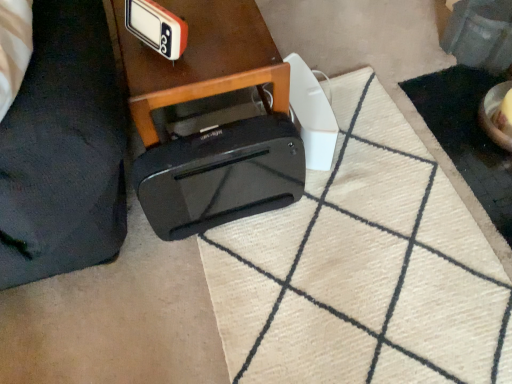
What is the approximate width of black plastic bag at lower left?

black plastic bag at lower left is 17.60 inches in width.

Describe the element at coordinates (220, 175) in the screenshot. I see `black plastic toaster at lower center` at that location.

Describe the element at coordinates (311, 115) in the screenshot. I see `white plastic speaker at center` at that location.

Where is `white textured doormat at lower center`? This screenshot has width=512, height=384. white textured doormat at lower center is located at coordinates (362, 268).

Which of these two, black plastic bag at lower left or white plastic speaker at center, stands taller?

black plastic bag at lower left is taller.

In terms of width, does black plastic bag at lower left look wider or thinner when compared to white plastic speaker at center?

Clearly, black plastic bag at lower left has more width compared to white plastic speaker at center.

Is there a large distance between black plastic bag at lower left and white plastic speaker at center?

No, black plastic bag at lower left is not far from white plastic speaker at center.

Which of these two, black glossy printer at center or white plastic speaker at center, stands taller?

black glossy printer at center is taller.

Considering the relative sizes of black glossy printer at center and white plastic speaker at center in the image provided, is black glossy printer at center bigger than white plastic speaker at center?

Indeed, black glossy printer at center has a larger size compared to white plastic speaker at center.

Based on the photo, would you say black plastic bag at lower left is outside white textured doormat at lower center?

Yes, black plastic bag at lower left is not within white textured doormat at lower center.

From the image's perspective, does black plastic bag at lower left appear higher than white textured doormat at lower center?

Yes, from the image's perspective, black plastic bag at lower left is on top of white textured doormat at lower center.

Is black plastic bag at lower left wider than white textured doormat at lower center?

Incorrect, the width of black plastic bag at lower left does not surpass that of white textured doormat at lower center.

Is black plastic bag at lower left positioned behind black plastic toaster at lower center?

No, black plastic bag at lower left is closer to the camera.

Based on their sizes in the image, would you say black plastic bag at lower left is bigger or smaller than black plastic toaster at lower center?

black plastic bag at lower left is bigger than black plastic toaster at lower center.

Is black plastic bag at lower left not within black plastic toaster at lower center?

black plastic bag at lower left is positioned outside black plastic toaster at lower center.

Is black plastic bag at lower left far away from black plastic toaster at lower center?

That's not correct — black plastic bag at lower left is a little close to black plastic toaster at lower center.

Between white textured doormat at lower center and orange plastic clock at upper center, which one has larger size?

Bigger between the two is white textured doormat at lower center.

Which is more to the right, white textured doormat at lower center or orange plastic clock at upper center?

Positioned to the right is white textured doormat at lower center.

From the image's perspective, which one is positioned higher, white textured doormat at lower center or orange plastic clock at upper center?

orange plastic clock at upper center, from the image's perspective.

In the scene shown: Which object is closer to the camera, white textured doormat at lower center or orange plastic clock at upper center?

orange plastic clock at upper center is closer to the camera.

Is orange plastic clock at upper center positioned before black glossy printer at center?

Yes, orange plastic clock at upper center is in front of black glossy printer at center.

In the scene shown: Is orange plastic clock at upper center bigger or smaller than black glossy printer at center?

orange plastic clock at upper center is smaller than black glossy printer at center.

How many degrees apart are the facing directions of orange plastic clock at upper center and black glossy printer at center?

orange plastic clock at upper center and black glossy printer at center are facing 148 degrees away from each other.

Which is less distant, (139, 10) or (166, 83)?

Point (139, 10).

Considering the positions of point (140, 38) and point (20, 235), is point (140, 38) closer or farther from the camera than point (20, 235)?

Point (140, 38).

Which is more to the left, orange plastic clock at upper center or black plastic bag at lower left?

Positioned to the left is black plastic bag at lower left.

How distant is orange plastic clock at upper center from black plastic bag at lower left?

They are 31.53 centimeters apart.

From a real-world perspective, which object stands above the other?

In real-world perspective, black plastic bag at lower left is above.

In order to click on appliance that appears above the black plastic bag at lower left (from the image's perspective) in this screenshot , I will do pyautogui.click(x=311, y=115).

This screenshot has height=384, width=512. In order to click on appliance on the right of black glossy printer at center in this screenshot , I will do [311, 115].

Which object lies nearer to the anchor point white textured doormat at lower center, black plastic bag at lower left or black glossy printer at center?

black glossy printer at center is closer to white textured doormat at lower center.

From the image, which object appears to be nearer to black plastic bag at lower left, orange plastic clock at upper center or black glossy printer at center?

black glossy printer at center is positioned closer to the anchor black plastic bag at lower left.

When comparing their distances from black plastic toaster at lower center, does orange plastic clock at upper center or white plastic speaker at center seem further?

Among the two, orange plastic clock at upper center is located further to black plastic toaster at lower center.

Considering their positions, is black plastic bag at lower left positioned closer to black glossy printer at center than white textured doormat at lower center?

black plastic bag at lower left.

Based on their spatial positions, is black glossy printer at center or black plastic bag at lower left further from black plastic toaster at lower center?

black plastic bag at lower left is further to black plastic toaster at lower center.

Estimate the real-world distances between objects in this image. Which object is closer to white plastic speaker at center, white textured doormat at lower center or orange plastic clock at upper center?

The object closer to white plastic speaker at center is white textured doormat at lower center.

From the image, which object appears to be nearer to black plastic bag at lower left, white textured doormat at lower center or orange plastic clock at upper center?

orange plastic clock at upper center.

In the scene shown: Estimate the real-world distances between objects in this image. Which object is closer to black plastic toaster at lower center, white textured doormat at lower center or black plastic bag at lower left?

Based on the image, black plastic bag at lower left appears to be nearer to black plastic toaster at lower center.

Locate an element on the screen. The height and width of the screenshot is (384, 512). gadget positioned between black plastic bag at lower left and black glossy printer at center from near to far is located at coordinates (156, 27).

Where is `table located between black plastic bag at lower left and white plastic speaker at center in the depth direction`? table located between black plastic bag at lower left and white plastic speaker at center in the depth direction is located at coordinates (201, 59).

Identify the location of toaster located between orange plastic clock at upper center and white plastic speaker at center in the left-right direction. (220, 175).

In order to click on toaster between black plastic bag at lower left and white plastic speaker at center from front to back in this screenshot , I will do `click(220, 175)`.